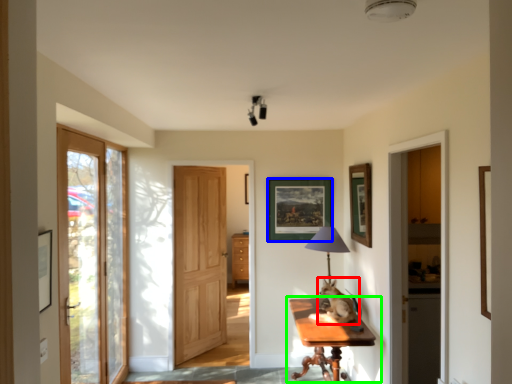
Question: Based on their relative distances, which object is farther from cat (highlighted by a red box)? Choose from picture frame (highlighted by a blue box) and table (highlighted by a green box).

Choices:
 (A) picture frame
 (B) table

Answer: (A)